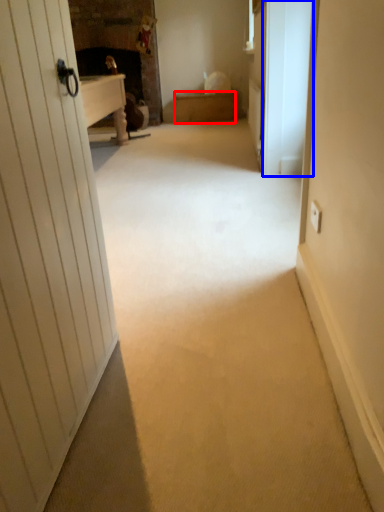
Question: Which object is further to the camera taking this photo, furniture (highlighted by a red box) or screen door (highlighted by a blue box)?

Choices:
 (A) furniture
 (B) screen door

Answer: (A)